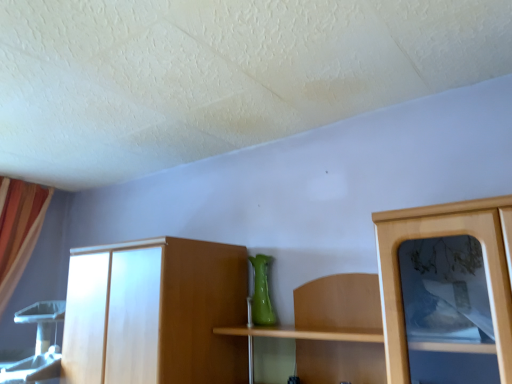
What do you see at coordinates (19, 230) in the screenshot?
I see `orange fabric curtain at left` at bounding box center [19, 230].

At what (x,y) coordinates should I click in order to perform the action: click on orange fabric curtain at left. Please return your answer as a coordinate pair (x, y). Looking at the image, I should click on (19, 230).

Measure the distance between point (253,259) and camera.

Point (253,259) and camera are 6.89 feet apart.

The image size is (512, 384). Describe the element at coordinates (261, 292) in the screenshot. I see `green matte vase at center` at that location.

From the picture: What is the approximate height of green matte vase at center?

green matte vase at center is 12.17 inches tall.

The height and width of the screenshot is (384, 512). What are the coordinates of `green matte vase at center` in the screenshot? It's located at (261, 292).

This screenshot has width=512, height=384. I want to click on orange fabric curtain at left, so click(19, 230).

Which object is positioned more to the right, orange fabric curtain at left or green matte vase at center?

green matte vase at center is more to the right.

Considering the relative positions of orange fabric curtain at left and green matte vase at center in the image provided, is orange fabric curtain at left behind green matte vase at center?

That is True.

Is point (36, 199) farther from camera compared to point (257, 291)?

Yes, point (36, 199) is farther from viewer.

From the image's perspective, between orange fabric curtain at left and green matte vase at center, which one is located above?

From the image's view, green matte vase at center is above.

From a real-world perspective, which object stands above the other?

orange fabric curtain at left, from a real-world perspective.

Considering the sizes of objects orange fabric curtain at left and green matte vase at center in the image provided, who is thinner, orange fabric curtain at left or green matte vase at center?

With smaller width is green matte vase at center.

Considering the sizes of orange fabric curtain at left and green matte vase at center in the image, is orange fabric curtain at left taller or shorter than green matte vase at center?

Considering their sizes, orange fabric curtain at left has more height than green matte vase at center.

Between orange fabric curtain at left and green matte vase at center, which one has larger size?

Bigger between the two is orange fabric curtain at left.

Based on the photo, is green matte vase at center surrounded by orange fabric curtain at left?

Actually, green matte vase at center is outside orange fabric curtain at left.

Are orange fabric curtain at left and green matte vase at center making contact?

They are not placed beside each other.

Is orange fabric curtain at left aimed at green matte vase at center?

Yes, orange fabric curtain at left is turned towards green matte vase at center.

This screenshot has width=512, height=384. I want to click on vase below the orange fabric curtain at left (from a real-world perspective), so click(x=261, y=292).

Consider the image. Is green matte vase at center at the right side of orange fabric curtain at left?

Yes.

Is green matte vase at center positioned behind orange fabric curtain at left?

No, the depth of green matte vase at center is less than that of orange fabric curtain at left.

Does point (263, 257) appear closer or farther from the camera than point (22, 263)?

Point (263, 257) appears to be closer to the viewer than point (22, 263).

From the image's perspective, does green matte vase at center appear higher than orange fabric curtain at left?

Indeed, from the image's perspective, green matte vase at center is shown above orange fabric curtain at left.

From a real-world perspective, relative to orange fabric curtain at left, is green matte vase at center vertically above or below?

In terms of real-world spatial position, green matte vase at center is below orange fabric curtain at left.

Between green matte vase at center and orange fabric curtain at left, which one has larger width?

With larger width is orange fabric curtain at left.

Between green matte vase at center and orange fabric curtain at left, which one has less height?

green matte vase at center is shorter.

Considering the relative sizes of green matte vase at center and orange fabric curtain at left in the image provided, is green matte vase at center smaller than orange fabric curtain at left?

Correct, green matte vase at center occupies less space than orange fabric curtain at left.

Is green matte vase at center completely or partially outside of orange fabric curtain at left?

Absolutely, green matte vase at center is external to orange fabric curtain at left.

Would you say green matte vase at center is a long distance from orange fabric curtain at left?

green matte vase at center is far away from orange fabric curtain at left.

Is green matte vase at center oriented towards orange fabric curtain at left?

No.

What's the angular difference between green matte vase at center and orange fabric curtain at left's facing directions?

The facing directions of green matte vase at center and orange fabric curtain at left are 89.4 degrees apart.

Locate an element on the screen. This screenshot has height=384, width=512. curtain lying behind the green matte vase at center is located at coordinates (19, 230).

The image size is (512, 384). I want to click on curtain above the green matte vase at center (from a real-world perspective), so click(x=19, y=230).

Where is `curtain lying on the left of green matte vase at center`? Image resolution: width=512 pixels, height=384 pixels. curtain lying on the left of green matte vase at center is located at coordinates (19, 230).